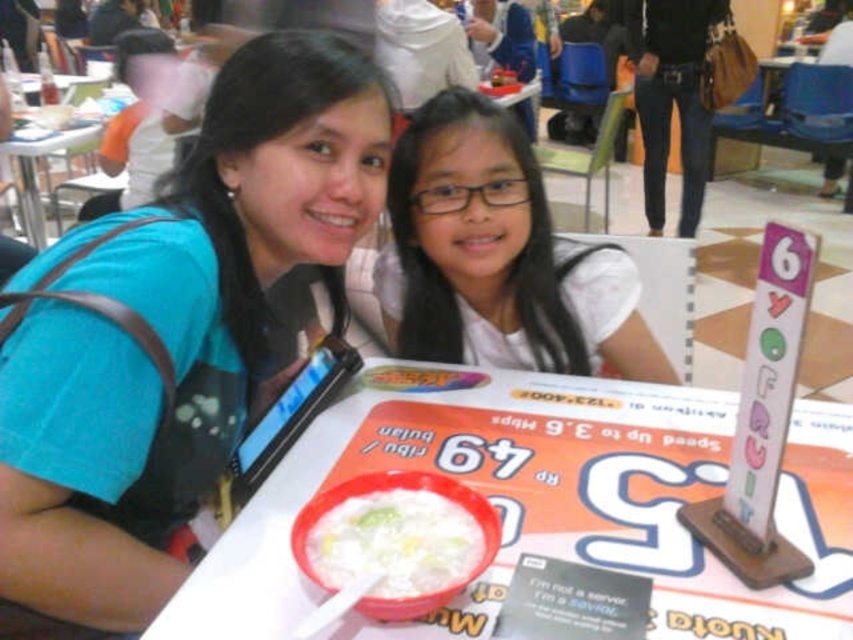
You are a photographer trying to capture the scene of two people at a table. You notice a point at coordinates [496,257] in the image. Based on the description provided, where is this point located in relation to the people?

The point at coordinates [496,257] is located on the white matte hair at center.

Consider the image. You are a photographer trying to capture a clear shot of both the white paperboard at center and the white creamy porridge at center. Which object should you focus on first to ensure it appears sharp in the photo?

You should focus on the white paperboard at center first because it is closer to you than the white creamy porridge at center, so adjusting focus starting from the closer object ensures both can be in focus.